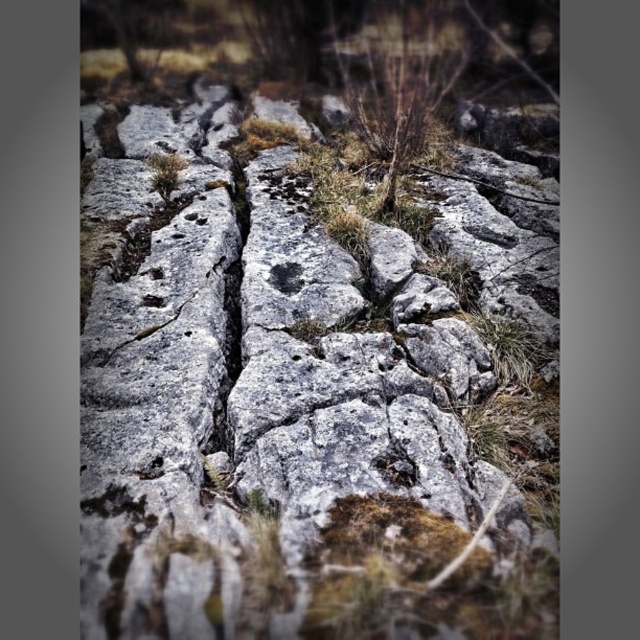
Which is in front, point (172, 156) or point (272, 266)?

Point (272, 266) is more forward.

What do you see at coordinates (164, 172) in the screenshot? I see `green mossy rock at upper center` at bounding box center [164, 172].

Which is behind, point (156, 161) or point (273, 276)?

Positioned behind is point (156, 161).

Locate an element on the screen. green mossy rock at upper center is located at coordinates (164, 172).

Between gray rough rock at center and gray stone at center, which one appears on the right side from the viewer's perspective?

gray rough rock at center

Is point (467, 244) farther from camera compared to point (276, 289)?

Yes.

Where is `gray rough rock at center`? gray rough rock at center is located at coordinates (291, 404).

Which of these two, gray rough rock at center or green mossy rock at upper center, stands shorter?

green mossy rock at upper center is shorter.

Between gray rough rock at center and green mossy rock at upper center, which one is positioned higher?

green mossy rock at upper center is above.

Is point (333, 408) more distant than point (176, 157)?

No, (333, 408) is in front of (176, 157).

At what (x,y) coordinates should I click in order to perform the action: click on gray rough rock at center. Please return your answer as a coordinate pair (x, y). Image resolution: width=640 pixels, height=640 pixels. Looking at the image, I should click on (291, 404).